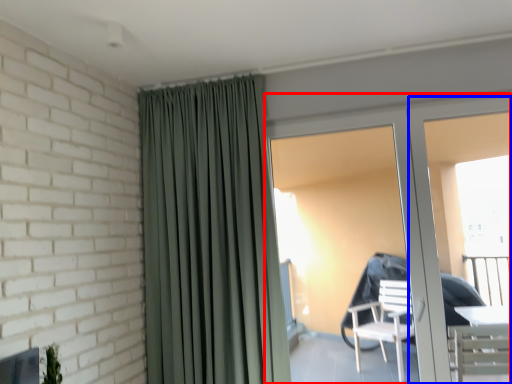
Question: Which point is further to the camera, door (highlighted by a red box) or screen door (highlighted by a blue box)?

Choices:
 (A) door
 (B) screen door

Answer: (B)